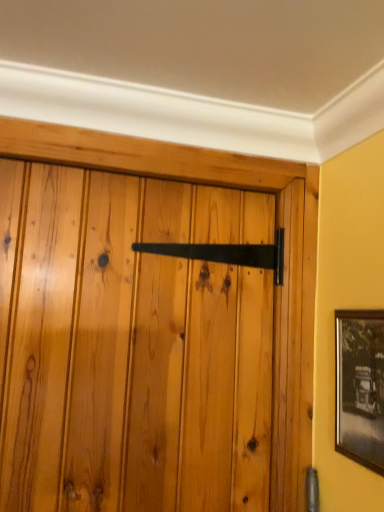
In order to face wooden framed picture at right, should I rotate leftwards or rightwards?

Rotate your view right by about 22.070°.

What do you see at coordinates (360, 386) in the screenshot? This screenshot has height=512, width=384. I see `wooden framed picture at right` at bounding box center [360, 386].

Measure the distance between point (377,428) and camera.

Point (377,428) is 88.80 centimeters from camera.

The width and height of the screenshot is (384, 512). What are the coordinates of `wooden framed picture at right` in the screenshot? It's located at (360, 386).

You are a GUI agent. You are given a task and a screenshot of the screen. Output one action in this format:
    pyautogui.click(x=<x>, y=<y>)
    Task: Click on the wooden framed picture at right
    The image size is (384, 512).
    Given the screenshot: What is the action you would take?
    pyautogui.click(x=360, y=386)